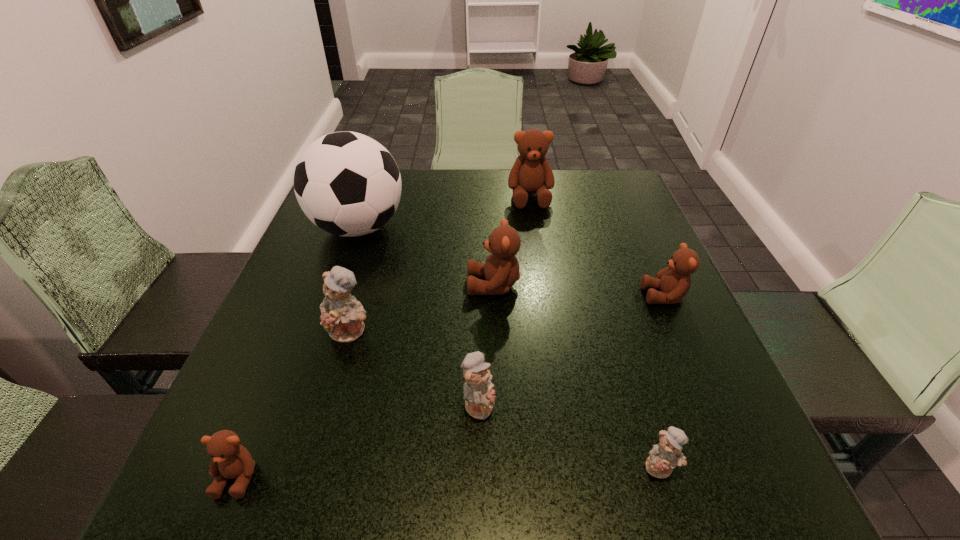
This screenshot has width=960, height=540. In order to click on free space located on the front-facing side of the second teddy bear from left to right in this screenshot , I will do `click(324, 423)`.

Identify the location of vacant region located on the face of the rightmost teddy bear. The height and width of the screenshot is (540, 960). (533, 296).

In order to click on vacant space located 0.130m on the face of the rightmost teddy bear in this screenshot , I will do `click(581, 296)`.

I want to click on vacant region located on the face of the rightmost teddy bear, so click(x=523, y=296).

Find the location of `vacant region located on the front-facing side of the second nearest blue teddy bear`. vacant region located on the front-facing side of the second nearest blue teddy bear is located at coordinates (543, 404).

Find the location of a particular element. This screenshot has width=960, height=540. soccer ball at the far edge is located at coordinates point(347,184).

The height and width of the screenshot is (540, 960). I want to click on teddy bear that is at the far edge, so click(x=531, y=173).

At what (x,y) coordinates should I click in order to perform the action: click on soccer ball positioned at the left edge. Please return your answer as a coordinate pair (x, y). Image resolution: width=960 pixels, height=540 pixels. Looking at the image, I should click on (347, 184).

Image resolution: width=960 pixels, height=540 pixels. In order to click on object at the far left corner in this screenshot , I will do `click(347, 184)`.

Where is `object at the near left corner`? Image resolution: width=960 pixels, height=540 pixels. object at the near left corner is located at coordinates (230, 460).